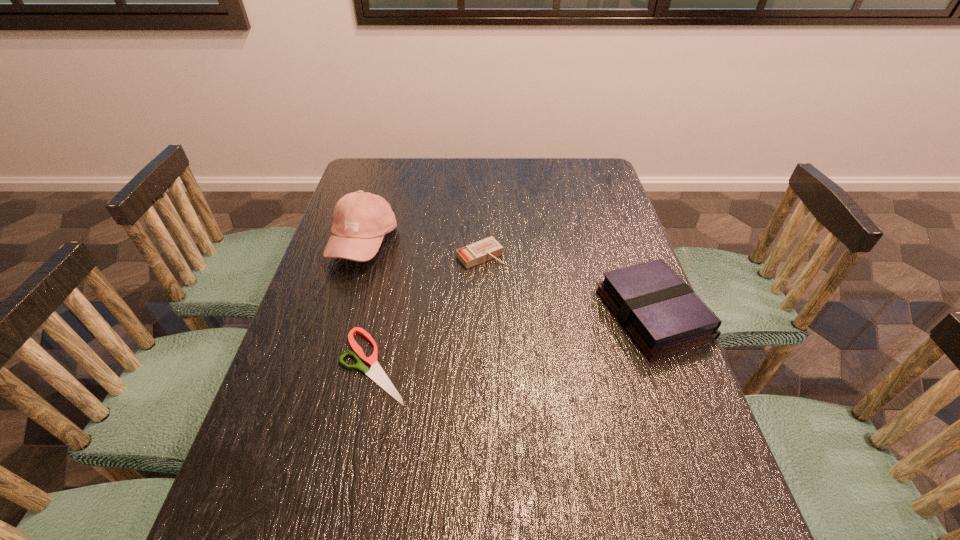
In the image, there is a desktop. Identify the location of vacant area at the near left corner. The image size is (960, 540). (266, 493).

Find the location of a particular element. The height and width of the screenshot is (540, 960). blank space at the near right corner is located at coordinates (637, 472).

I want to click on vacant area that lies between the shortest object and the rightmost object, so click(x=514, y=340).

I want to click on free space between the scissors and the second tallest object, so click(514, 340).

The width and height of the screenshot is (960, 540). Identify the location of unoccupied area between the shortest object and the baseball cap. (369, 305).

The height and width of the screenshot is (540, 960). Find the location of `empty space that is in between the book and the baseball cap`. empty space that is in between the book and the baseball cap is located at coordinates (509, 279).

Locate an element on the screen. The height and width of the screenshot is (540, 960). vacant space that's between the third tallest object and the shortest object is located at coordinates (427, 310).

Locate an element on the screen. free spot between the rightmost object and the tallest object is located at coordinates (509, 279).

What are the coordinates of `free spot between the matchbox and the baseball cap` in the screenshot? It's located at (422, 249).

Find the location of `free space between the shortest object and the tallest object`. free space between the shortest object and the tallest object is located at coordinates (369, 305).